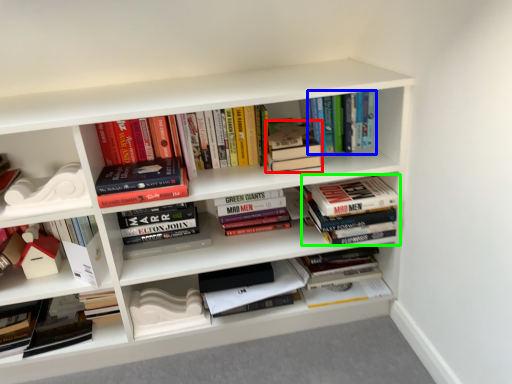
Question: Based on their relative distances, which object is nearer to book (highlighted by a red box)? Choose from book (highlighted by a blue box) and book (highlighted by a green box).

Choices:
 (A) book
 (B) book

Answer: (A)